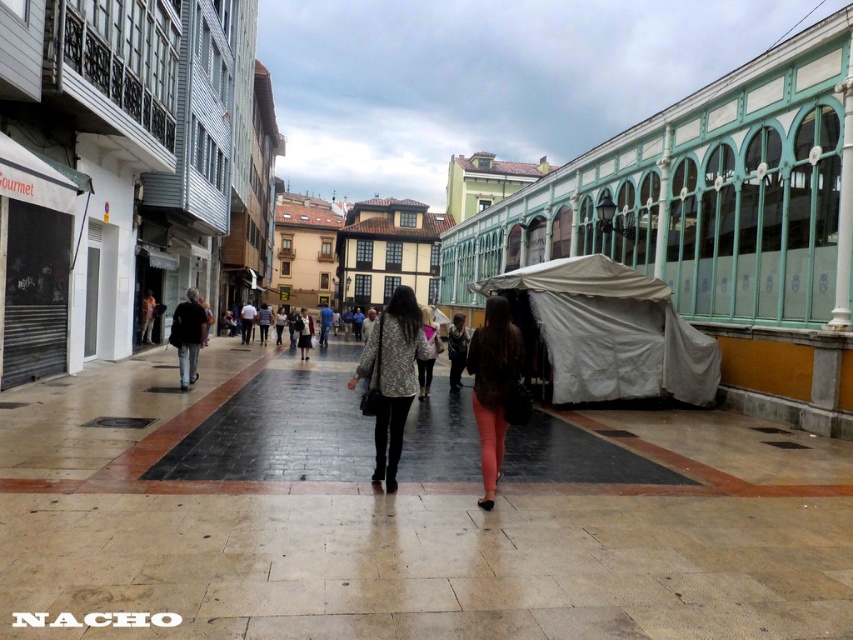
Question: Can you confirm if polished stone pavement at center is positioned to the right of white fabric canopy at center?

Choices:
 (A) no
 (B) yes

Answer: (A)

Question: Which of these objects is positioned farthest from the white fabric canopy at center?

Choices:
 (A) patterned fabric coat at center
 (B) light brown leather jacket at center

Answer: (B)

Question: Does polished stone pavement at center appear over leather jacket at center?

Choices:
 (A) yes
 (B) no

Answer: (B)

Question: Does light brown leather jacket at center have a greater width compared to leather jacket at center?

Choices:
 (A) yes
 (B) no

Answer: (B)

Question: Which point is closer to the camera?

Choices:
 (A) (183, 356)
 (B) (457, 348)

Answer: (A)

Question: Among these points, which one is nearest to the camera?

Choices:
 (A) (300, 332)
 (B) (463, 316)
 (C) (329, 560)

Answer: (C)